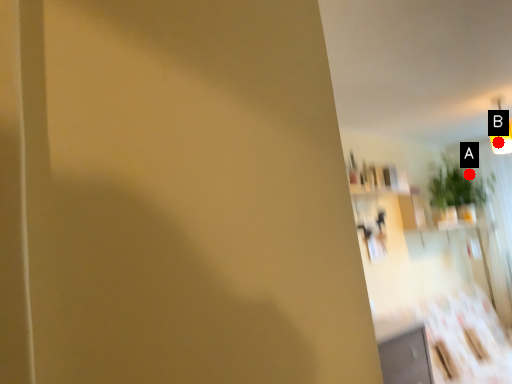
Question: Two points are circled on the image, labeled by A and B beside each circle. Which point is farther to the camera?

Choices:
 (A) A is further
 (B) B is further

Answer: (A)